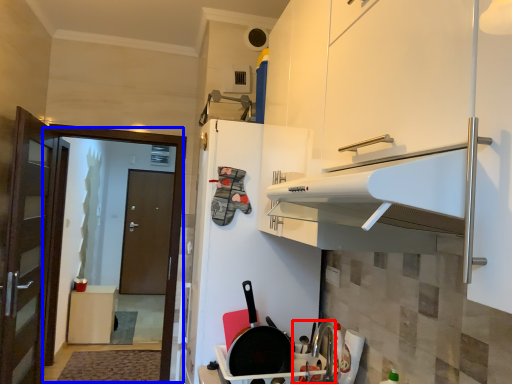
Question: Which point is further to the camera, sink (highlighted by a red box) or screen door (highlighted by a blue box)?

Choices:
 (A) sink
 (B) screen door

Answer: (B)